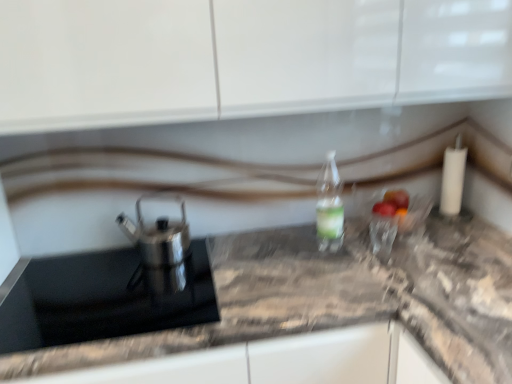
Question: From the image's perspective, is satin silver teapot at left positioned above or below clear plastic bottle at center?

Choices:
 (A) above
 (B) below

Answer: (B)

Question: Considering the positions of satin silver teapot at left and clear plastic bottle at center in the image, is satin silver teapot at left taller or shorter than clear plastic bottle at center?

Choices:
 (A) short
 (B) tall

Answer: (A)

Question: Considering the real-world distances, which object is farthest from the satin silver teapot at left?

Choices:
 (A) clear plastic bottle at center
 (B) marble gray countertop at center
 (C) black glass sink at left

Answer: (A)

Question: Which of these objects is positioned farthest from the marble gray countertop at center?

Choices:
 (A) black glass sink at left
 (B) satin silver teapot at left
 (C) clear plastic bottle at center

Answer: (B)